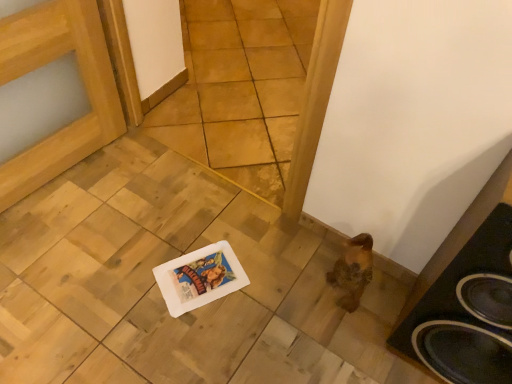
Question: Can you confirm if black matte speaker at lower right is smaller than natural wood tile at center?

Choices:
 (A) no
 (B) yes

Answer: (B)

Question: Does black matte speaker at lower right appear on the left side of natural wood tile at center?

Choices:
 (A) no
 (B) yes

Answer: (A)

Question: Does black matte speaker at lower right appear on the right side of natural wood tile at center?

Choices:
 (A) no
 (B) yes

Answer: (B)

Question: Is black matte speaker at lower right with natural wood tile at center?

Choices:
 (A) no
 (B) yes

Answer: (A)

Question: Considering the relative sizes of black matte speaker at lower right and natural wood tile at center in the image provided, is black matte speaker at lower right bigger than natural wood tile at center?

Choices:
 (A) no
 (B) yes

Answer: (A)

Question: Considering the relative sizes of black matte speaker at lower right and natural wood tile at center in the image provided, is black matte speaker at lower right wider than natural wood tile at center?

Choices:
 (A) no
 (B) yes

Answer: (B)

Question: From a real-world perspective, does natural wood tile at center sit lower than black matte speaker at lower right?

Choices:
 (A) no
 (B) yes

Answer: (A)

Question: Is natural wood tile at center outside of black matte speaker at lower right?

Choices:
 (A) no
 (B) yes

Answer: (B)

Question: Considering the relative sizes of natural wood tile at center and black matte speaker at lower right in the image provided, is natural wood tile at center bigger than black matte speaker at lower right?

Choices:
 (A) yes
 (B) no

Answer: (A)

Question: Is natural wood tile at center positioned behind black matte speaker at lower right?

Choices:
 (A) yes
 (B) no

Answer: (A)

Question: Can you confirm if natural wood tile at center is shorter than black matte speaker at lower right?

Choices:
 (A) no
 (B) yes

Answer: (A)

Question: From a real-world perspective, is natural wood tile at center located higher than black matte speaker at lower right?

Choices:
 (A) yes
 (B) no

Answer: (A)

Question: Considering the positions of point (471, 357) and point (218, 125), is point (471, 357) closer or farther from the camera than point (218, 125)?

Choices:
 (A) farther
 (B) closer

Answer: (B)